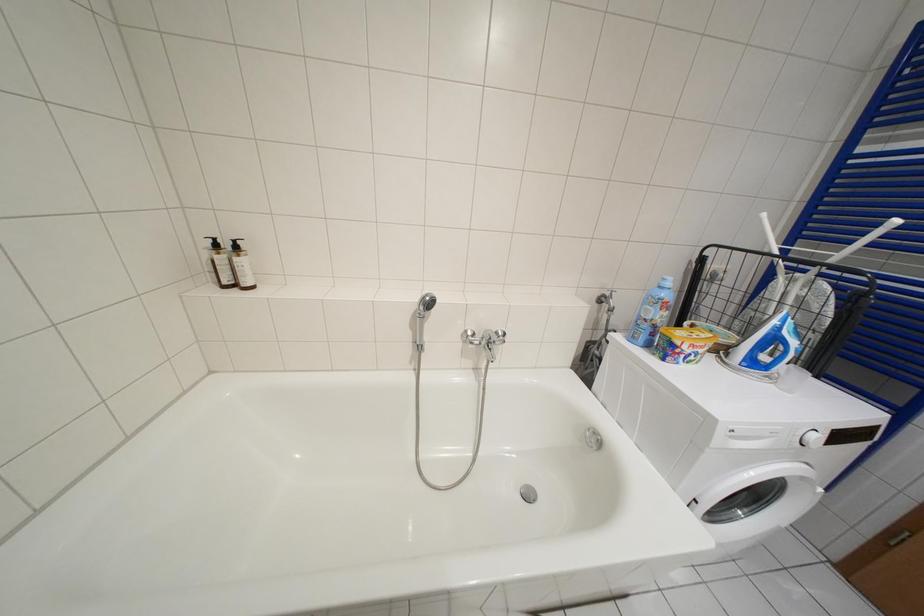
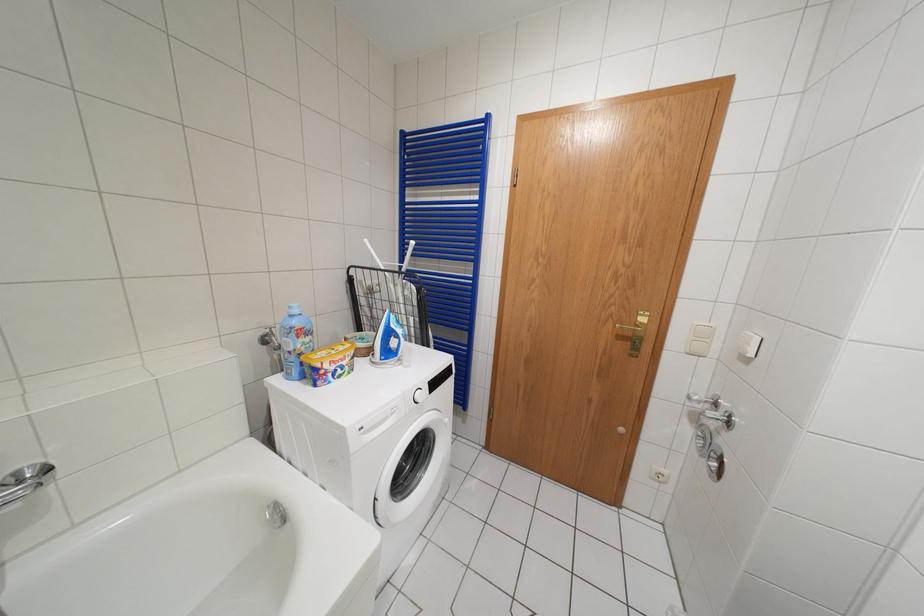
Question: Based on the continuous images, in which direction is the camera rotating? Reply with the corresponding letter.

Choices:
 (A) Left
 (B) Right
 (C) Up
 (D) Down

Answer: (B)